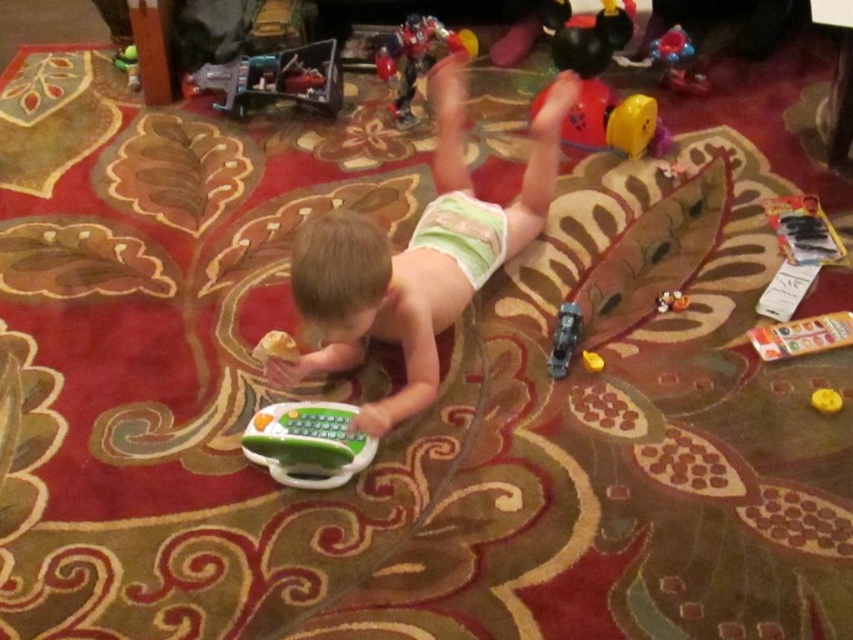
From the picture: Does smooth plastic toy at center appear under matte plastic toy at center?

No, smooth plastic toy at center is not below matte plastic toy at center.

Can you confirm if smooth plastic toy at center is shorter than matte plastic toy at center?

No.

This screenshot has width=853, height=640. I want to click on smooth plastic toy at center, so click(416, 257).

Does metallic plastic toy at upper left have a greater height compared to metallic blue toy car at lower right?

Indeed, metallic plastic toy at upper left has a greater height compared to metallic blue toy car at lower right.

Does point (328, 106) lie in front of point (573, 337)?

No, it is not.

Identify the location of metallic plastic toy at upper left. (276, 77).

Can you confirm if rubberized red and yellow toy at upper right is smaller than yellow matte toy at center?

No.

Who is positioned more to the left, rubberized red and yellow toy at upper right or yellow matte toy at center?

rubberized red and yellow toy at upper right

This screenshot has width=853, height=640. Find the location of `rubberized red and yellow toy at upper right`. rubberized red and yellow toy at upper right is located at coordinates (608, 120).